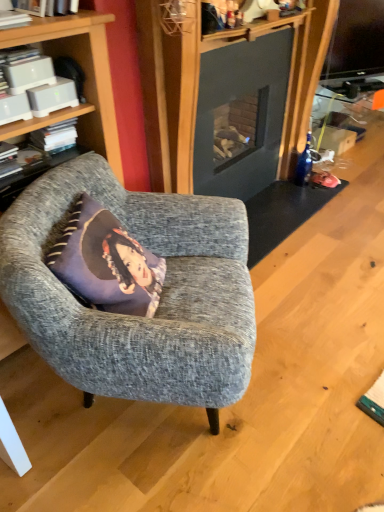
Question: Looking at the image, does white matte book at upper left, which is the first book from front to back, seem bigger or smaller compared to purple fabric pillow at center?

Choices:
 (A) small
 (B) big

Answer: (A)

Question: From the image's perspective, is white matte book at upper left, which is the first book from front to back, above or below purple fabric pillow at center?

Choices:
 (A) above
 (B) below

Answer: (A)

Question: Which of these objects is positioned farthest from the white plastic book at upper left, which appears as the 2th book when viewed from the front?

Choices:
 (A) white matte book at upper left, which is the 3th book from back to front
 (B) dark gray fabric cushion at left
 (C) white matte book at left, the third book when ordered from front to back
 (D) purple fabric pillow at center
 (E) textured gray armchair at left

Answer: (E)

Question: Which is nearer to the white matte book at left, the third book when ordered from front to back?

Choices:
 (A) textured gray armchair at left
 (B) white plastic book at upper left, which appears as the 2th book when viewed from the front
 (C) purple fabric pillow at center
 (D) dark gray fabric cushion at left
 (E) white matte book at upper left, which is the 3th book from back to front

Answer: (D)